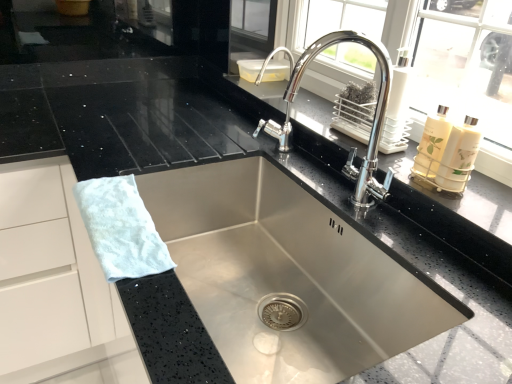
This screenshot has width=512, height=384. What do you see at coordinates (121, 228) in the screenshot?
I see `white fluffy hand towel at left` at bounding box center [121, 228].

In order to face white fluffy hand towel at left, should I rotate leftwards or rightwards?

Turn left by 17.268 degrees to look at white fluffy hand towel at left.

This screenshot has width=512, height=384. Find the location of `white fluffy hand towel at left`. white fluffy hand towel at left is located at coordinates (121, 228).

Is white fluffy hand towel at left completely or partially outside of polished chrome faucet at upper center?

Yes, white fluffy hand towel at left is outside of polished chrome faucet at upper center.

Based on their sizes in the image, would you say white fluffy hand towel at left is bigger or smaller than polished chrome faucet at upper center?

white fluffy hand towel at left is smaller than polished chrome faucet at upper center.

Is white fluffy hand towel at left facing towards polished chrome faucet at upper center?

No, white fluffy hand towel at left is not facing towards polished chrome faucet at upper center.

Does white fluffy hand towel at left touch polished chrome faucet at upper center?

No, white fluffy hand towel at left is not touching polished chrome faucet at upper center.

This screenshot has width=512, height=384. Find the location of `tap behind the stainless steel sink at center`. tap behind the stainless steel sink at center is located at coordinates (372, 123).

From a real-world perspective, between stainless steel sink at center and polished chrome faucet at upper center, who is vertically lower?

In real-world perspective, stainless steel sink at center is lower.

Does stainless steel sink at center have a greater width compared to polished chrome faucet at upper center?

Yes, stainless steel sink at center is wider than polished chrome faucet at upper center.

Is stainless steel sink at center further to camera compared to polished chrome faucet at upper center?

No, it is not.

From the image's perspective, is polished chrome faucet at upper center located above or below stainless steel sink at center?

Clearly, from the image's perspective, polished chrome faucet at upper center is above stainless steel sink at center.

Which of these two, polished chrome faucet at upper center or stainless steel sink at center, is thinner?

With smaller width is polished chrome faucet at upper center.

In order to click on sink lying below the polished chrome faucet at upper center (from the image's perspective) in this screenshot , I will do `click(373, 121)`.

Could you tell me if polished chrome faucet at upper center is facing stainless steel sink at center?

No.

Is white fluffy hand towel at left to the left of stainless steel sink at center from the viewer's perspective?

Yes, white fluffy hand towel at left is to the left of stainless steel sink at center.

In terms of width, does white fluffy hand towel at left look wider or thinner when compared to stainless steel sink at center?

Clearly, white fluffy hand towel at left has less width compared to stainless steel sink at center.

Does white fluffy hand towel at left turn towards stainless steel sink at center?

Yes, white fluffy hand towel at left is facing stainless steel sink at center.

From a real-world perspective, is white fluffy hand towel at left located beneath stainless steel sink at center?

No, from a real-world perspective, white fluffy hand towel at left is not below stainless steel sink at center.

Is stainless steel sink at center wider or thinner than white fluffy hand towel at left?

Clearly, stainless steel sink at center has more width compared to white fluffy hand towel at left.

Do you think stainless steel sink at center is within white fluffy hand towel at left, or outside of it?

stainless steel sink at center is located beyond the bounds of white fluffy hand towel at left.

Does stainless steel sink at center have a smaller size compared to white fluffy hand towel at left?

Actually, stainless steel sink at center might be larger than white fluffy hand towel at left.

Between stainless steel sink at center and white fluffy hand towel at left, which one has less height?

white fluffy hand towel at left.

Is polished chrome faucet at upper center not near white fluffy hand towel at left?

That's not correct — polished chrome faucet at upper center is a little close to white fluffy hand towel at left.

Who is smaller, polished chrome faucet at upper center or white fluffy hand towel at left?

white fluffy hand towel at left is smaller.

Does point (316, 50) lie behind point (133, 199)?

No.

Considering the sizes of polished chrome faucet at upper center and white fluffy hand towel at left in the image, is polished chrome faucet at upper center wider or thinner than white fluffy hand towel at left?

Considering their sizes, polished chrome faucet at upper center looks broader than white fluffy hand towel at left.

You are a GUI agent. You are given a task and a screenshot of the screen. Output one action in this format:
    pyautogui.click(x=<x>, y=<y>)
    Task: Click on the hand towel that appears below the polished chrome faucet at upper center (from the image's perspective)
    This screenshot has width=512, height=384.
    Given the screenshot: What is the action you would take?
    pyautogui.click(x=121, y=228)

The height and width of the screenshot is (384, 512). I want to click on sink located in front of the polished chrome faucet at upper center, so click(373, 121).

From the image, which object appears to be farther from polished chrome faucet at upper center, white fluffy hand towel at left or stainless steel sink at center?

Based on the image, white fluffy hand towel at left appears to be further to polished chrome faucet at upper center.

Which object lies further to the anchor point stainless steel sink at center, white fluffy hand towel at left or polished chrome faucet at upper center?

The object further to stainless steel sink at center is white fluffy hand towel at left.

Estimate the real-world distances between objects in this image. Which object is further from stainless steel sink at center, polished chrome faucet at upper center or white fluffy hand towel at left?

white fluffy hand towel at left lies further to stainless steel sink at center than the other object.

When comparing their distances from white fluffy hand towel at left, does polished chrome faucet at upper center or stainless steel sink at center seem further?

Based on the image, polished chrome faucet at upper center appears to be further to white fluffy hand towel at left.

Which object lies nearer to the anchor point white fluffy hand towel at left, stainless steel sink at center or polished chrome faucet at upper center?

Among the two, stainless steel sink at center is located nearer to white fluffy hand towel at left.

Based on their spatial positions, is stainless steel sink at center or white fluffy hand towel at left closer to polished chrome faucet at upper center?

stainless steel sink at center is positioned closer to the anchor polished chrome faucet at upper center.

Where is `sink between white fluffy hand towel at left and polished chrome faucet at upper center`? sink between white fluffy hand towel at left and polished chrome faucet at upper center is located at coordinates (373, 121).